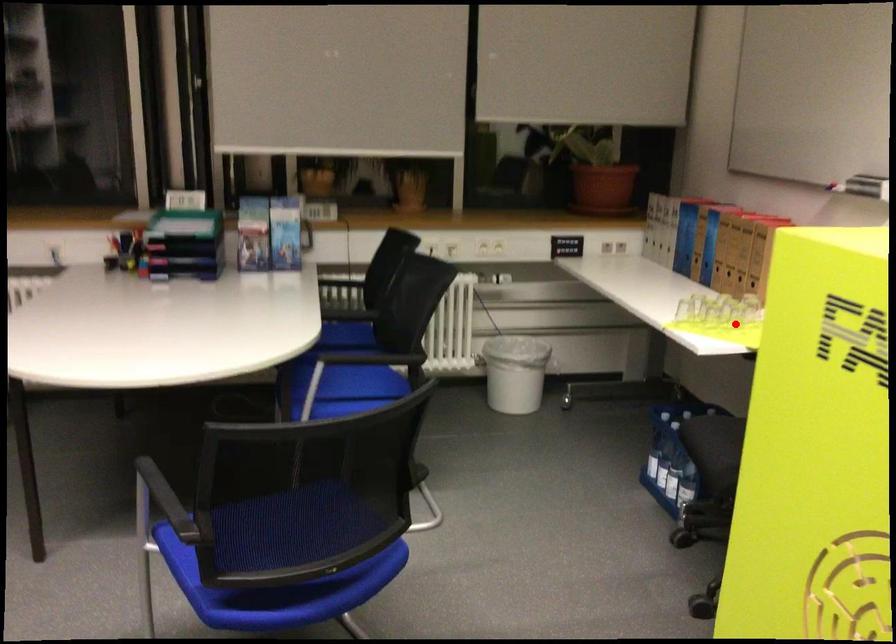
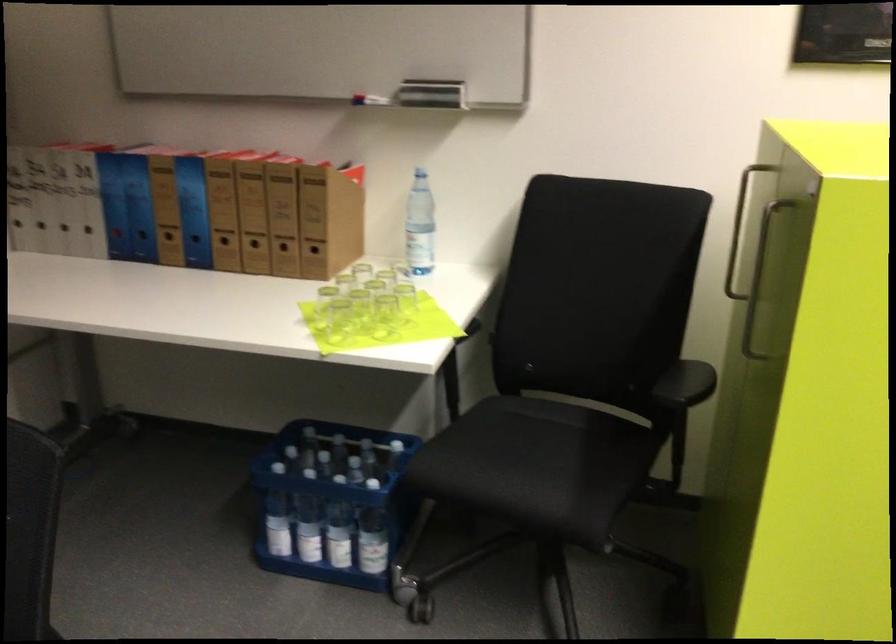
Question: I am providing you with two images of the same scene from different viewpoints. In image1, a red point is highlighted. Considering the same 3D point in image2, which of the following is correct?

Choices:
 (A) It is closer
 (B) It is farther

Answer: (A)